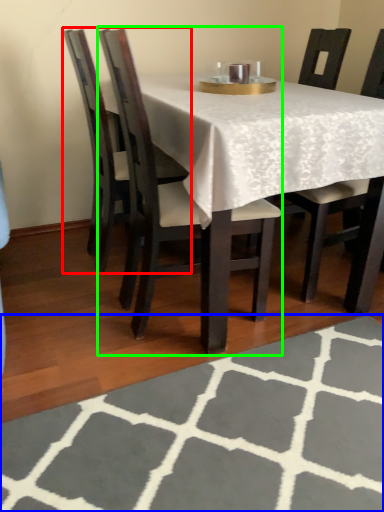
Question: Which is nearer to the chair (highlighted by a red box)? place mat (highlighted by a blue box) or chair (highlighted by a green box).

Choices:
 (A) place mat
 (B) chair

Answer: (B)